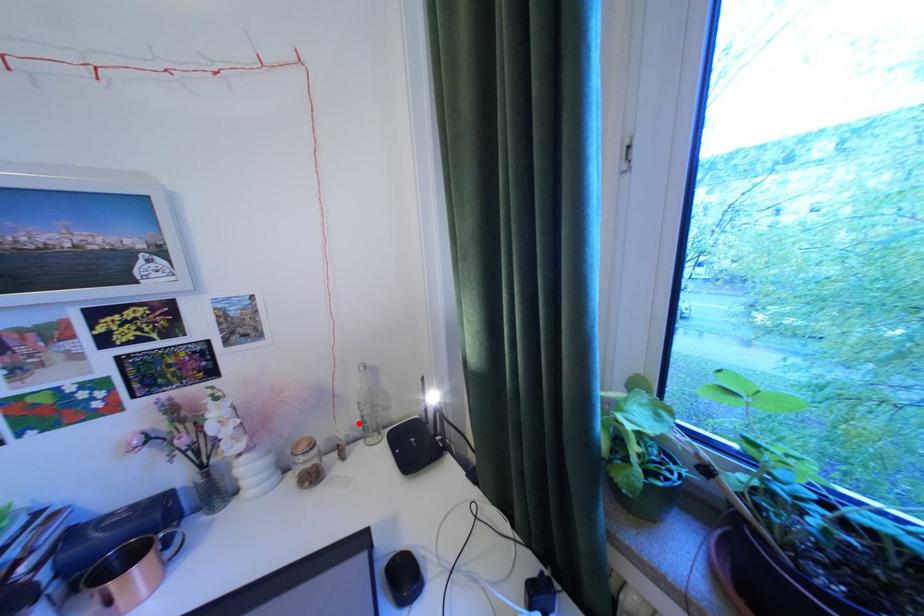
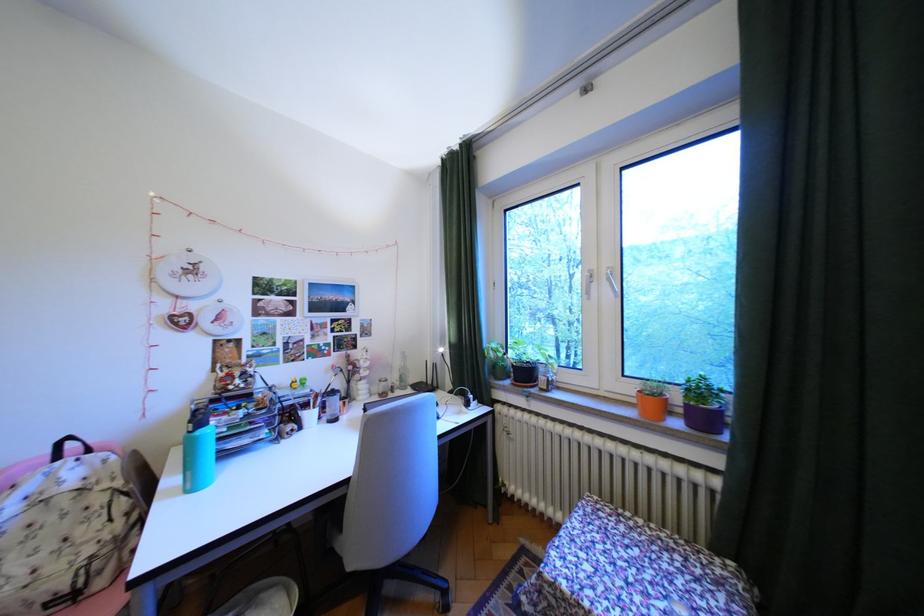
Question: I am providing you with two images of the same scene from different viewpoints. In image1, a red point is highlighted. Considering the same 3D point in image2, which of the following is correct?

Choices:
 (A) It is closer
 (B) It is farther

Answer: (A)